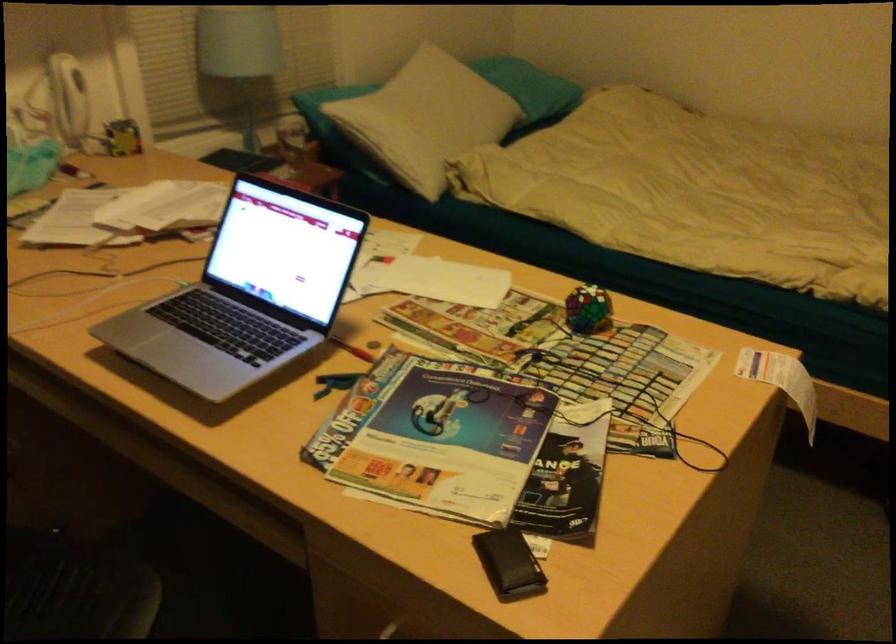
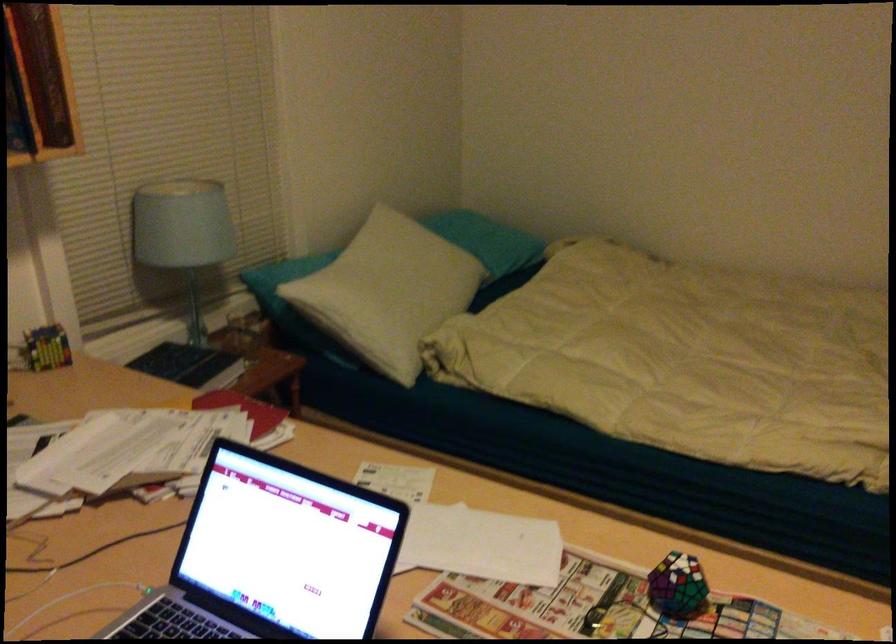
Where in the second image is the point corresponding to the point at 424,115 from the first image?

(391, 285)